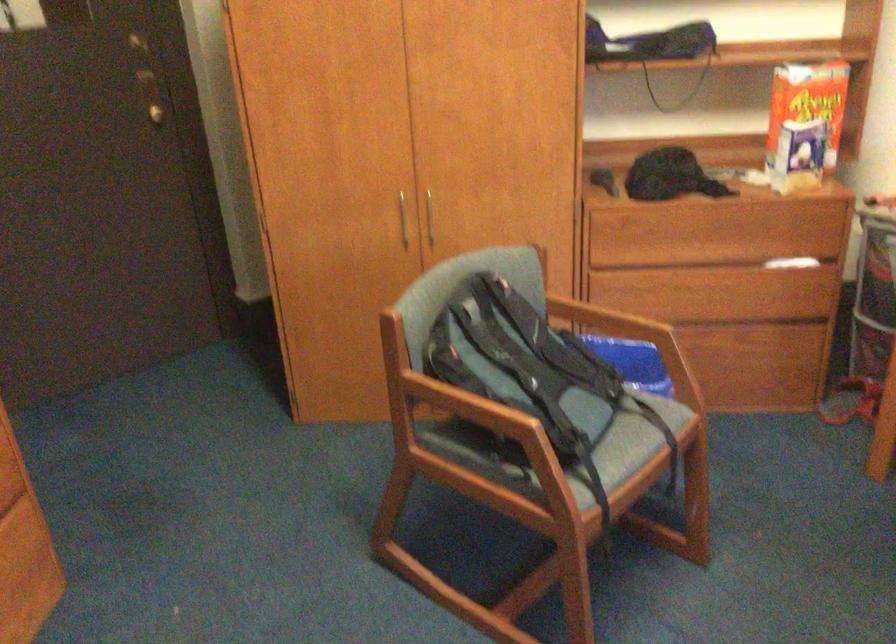
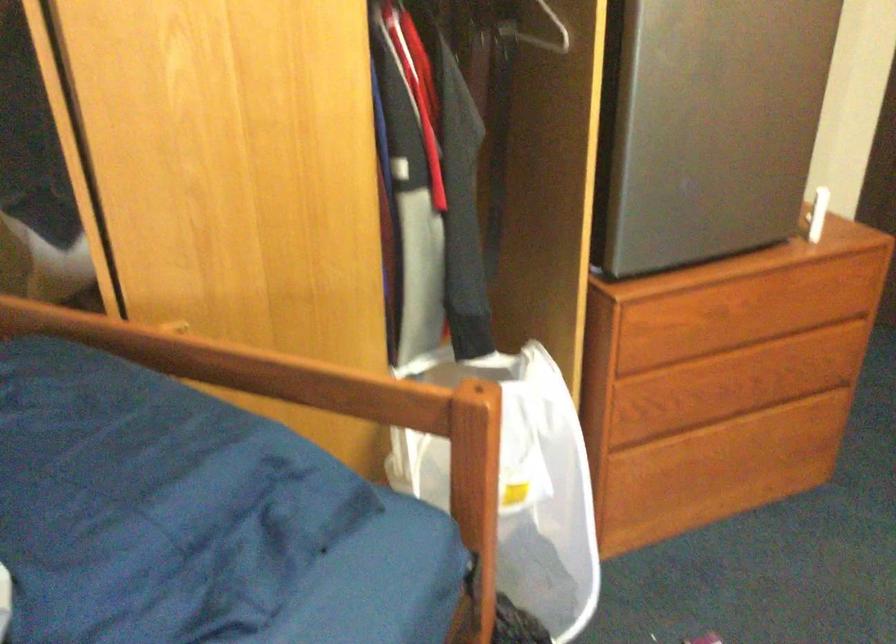
How did the camera likely rotate?

The camera's rotation is toward left-down.